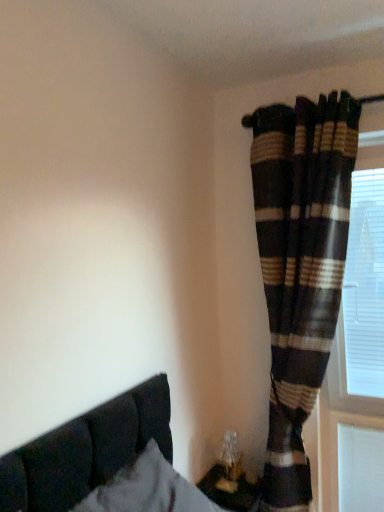
Locate an element on the screen. This screenshot has height=512, width=384. suede-like dark brown bed at lower left is located at coordinates (104, 462).

The height and width of the screenshot is (512, 384). In order to click on plaid fabric curtain at right in this screenshot , I will do `click(300, 266)`.

Is suede-like dark brown bed at lower left in front of or behind plaid fabric curtain at right in the image?

Visually, suede-like dark brown bed at lower left is located in front of plaid fabric curtain at right.

From the image's perspective, is suede-like dark brown bed at lower left located beneath plaid fabric curtain at right?

Correct, suede-like dark brown bed at lower left appears lower than plaid fabric curtain at right in the image.

In order to click on curtain on the right side of suede-like dark brown bed at lower left in this screenshot , I will do `click(300, 266)`.

From the picture: From the image's perspective, between white plastic blinds at right and suede-like dark brown bed at lower left, which one is located above?

white plastic blinds at right, from the image's perspective.

Does white plastic blinds at right have a greater height compared to suede-like dark brown bed at lower left?

Yes, white plastic blinds at right is taller than suede-like dark brown bed at lower left.

Find the location of `bay window on the right of the suede-like dark brown bed at lower left`. bay window on the right of the suede-like dark brown bed at lower left is located at coordinates (365, 287).

From a real-world perspective, does white plastic blinds at right sit lower than suede-like dark brown bed at lower left?

No, from a real-world perspective, white plastic blinds at right is not below suede-like dark brown bed at lower left.

Can you see plaid fabric curtain at right touching white plastic blinds at right?

No, plaid fabric curtain at right is not with white plastic blinds at right.

From a real-world perspective, is plaid fabric curtain at right physically below white plastic blinds at right?

Indeed, from a real-world perspective, plaid fabric curtain at right is positioned beneath white plastic blinds at right.

Which is correct: plaid fabric curtain at right is inside white plastic blinds at right, or outside of it?

plaid fabric curtain at right is not enclosed by white plastic blinds at right.

Is plaid fabric curtain at right wider or thinner than white plastic blinds at right?

In the image, plaid fabric curtain at right appears to be wider than white plastic blinds at right.

Is plaid fabric curtain at right facing towards suede-like dark brown bed at lower left?

Yes, plaid fabric curtain at right is oriented towards suede-like dark brown bed at lower left.

What's the angular difference between plaid fabric curtain at right and suede-like dark brown bed at lower left's facing directions?

There is a 85.7-degree angle between the facing directions of plaid fabric curtain at right and suede-like dark brown bed at lower left.

Is plaid fabric curtain at right not near suede-like dark brown bed at lower left?

No, plaid fabric curtain at right is in close proximity to suede-like dark brown bed at lower left.

Is plaid fabric curtain at right inside or outside of suede-like dark brown bed at lower left?

plaid fabric curtain at right is not inside suede-like dark brown bed at lower left, it's outside.

Between white plastic blinds at right and plaid fabric curtain at right, which one has less height?

Standing shorter between the two is white plastic blinds at right.

How much distance is there between white plastic blinds at right and plaid fabric curtain at right?

white plastic blinds at right and plaid fabric curtain at right are 9.12 inches apart from each other.

How many degrees apart are the facing directions of white plastic blinds at right and plaid fabric curtain at right?

The angular difference between white plastic blinds at right and plaid fabric curtain at right is 6.62 degrees.

Who is bigger, white plastic blinds at right or plaid fabric curtain at right?

Bigger between the two is plaid fabric curtain at right.

From a real-world perspective, does suede-like dark brown bed at lower left stand above white plastic blinds at right?

Incorrect, from a real-world perspective, suede-like dark brown bed at lower left is lower than white plastic blinds at right.

Is suede-like dark brown bed at lower left inside or outside of white plastic blinds at right?

The correct answer is: outside.

Is point (68, 428) closer to viewer compared to point (365, 377)?

Yes, it is.

Is suede-like dark brown bed at lower left in contact with white plastic blinds at right?

No, suede-like dark brown bed at lower left is not making contact with white plastic blinds at right.

The image size is (384, 512). Find the location of `curtain lying behind the suede-like dark brown bed at lower left`. curtain lying behind the suede-like dark brown bed at lower left is located at coordinates (300, 266).

Identify the location of bed lying below the white plastic blinds at right (from the image's perspective). The image size is (384, 512). (104, 462).

Estimate the real-world distances between objects in this image. Which object is closer to white plastic blinds at right, suede-like dark brown bed at lower left or plaid fabric curtain at right?

The object closer to white plastic blinds at right is plaid fabric curtain at right.

Looking at the image, which one is located further to plaid fabric curtain at right, suede-like dark brown bed at lower left or white plastic blinds at right?

suede-like dark brown bed at lower left.

From the picture: When comparing their distances from suede-like dark brown bed at lower left, does plaid fabric curtain at right or white plastic blinds at right seem closer?

plaid fabric curtain at right lies closer to suede-like dark brown bed at lower left than the other object.

Looking at the image, which one is located closer to plaid fabric curtain at right, white plastic blinds at right or suede-like dark brown bed at lower left?

white plastic blinds at right is positioned closer to the anchor plaid fabric curtain at right.

Estimate the real-world distances between objects in this image. Which object is further from white plastic blinds at right, plaid fabric curtain at right or suede-like dark brown bed at lower left?

Based on the image, suede-like dark brown bed at lower left appears to be further to white plastic blinds at right.

When comparing their distances from suede-like dark brown bed at lower left, does white plastic blinds at right or plaid fabric curtain at right seem closer?

plaid fabric curtain at right is closer to suede-like dark brown bed at lower left.

At what (x,y) coordinates should I click in order to perform the action: click on curtain between suede-like dark brown bed at lower left and white plastic blinds at right from front to back. Please return your answer as a coordinate pair (x, y). Looking at the image, I should click on (300, 266).